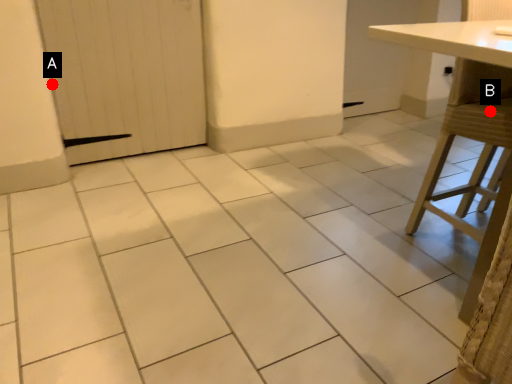
Question: Two points are circled on the image, labeled by A and B beside each circle. Which point is further to the camera?

Choices:
 (A) A is further
 (B) B is further

Answer: (A)